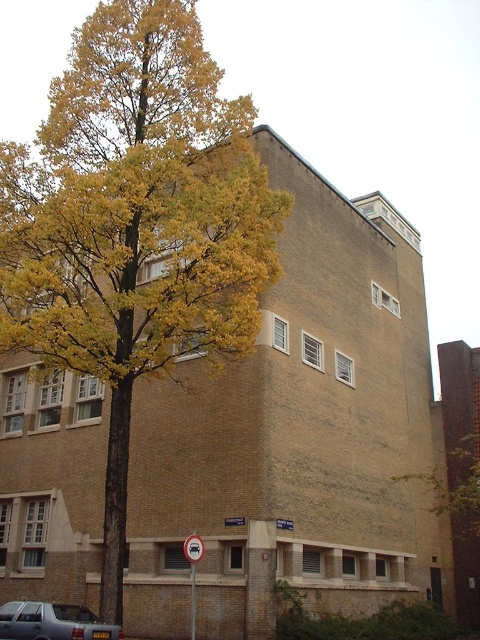
You are standing in front of the building and want to determine the relative positions of two points marked on the facade. The first point is at coordinates point (239, 198) and the second is at point (106, 637). Which point appears closer to you?

Point (239, 198) is further to the viewer than point (106, 637), so the second point appears closer to you.

You are a photographer planning to take a picture of the yellow leafy tree at upper left and the silver metallic car at lower left from the front of the building. Which object will appear bigger in the photo?

The yellow leafy tree at upper left will appear bigger in the photo because it has a larger size compared to the silver metallic car at lower left.